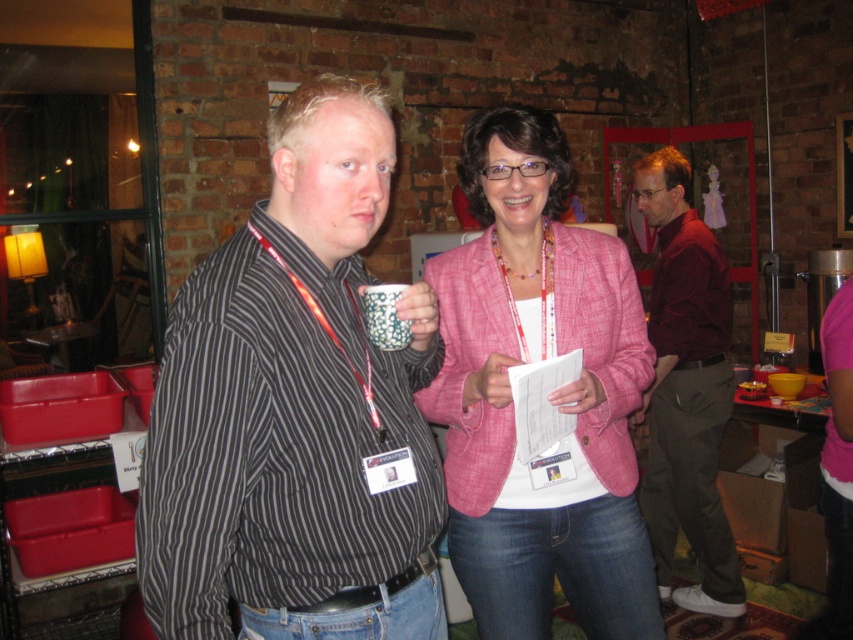
You are a photographer at the event and need to capture a photo where both the pink textured blazer at center and the glossy ceramic mug at upper center are clearly visible. Considering their sizes, which object should you focus on to ensure both are in frame?

The pink textured blazer at center is much taller than the glossy ceramic mug at upper center, so focusing on the blazer will ensure both objects are in frame as the mug is smaller and positioned above it.

You are a photographer at the event and need to capture a clear photo of the black striped shirt at center without the glossy ceramic mug at upper center blocking it. How should you adjust your camera angle?

To avoid the glossy ceramic mug at upper center blocking the black striped shirt at center, you should position the camera so that it looks downward from above the mug, as the black striped shirt at center is in front of the mug. This angle will allow the shirt to be visible while the mug is out of frame or obscured.